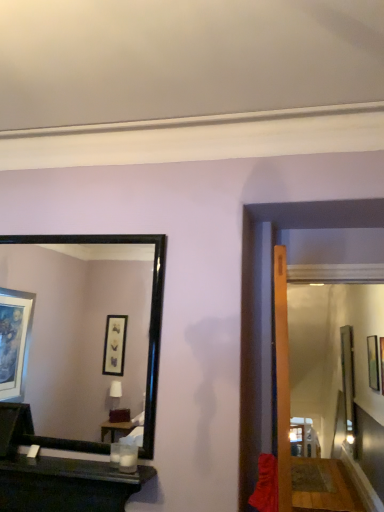
The width and height of the screenshot is (384, 512). I want to click on black glossy mirror at upper left, so click(x=79, y=336).

What do you see at coordinates (79, 336) in the screenshot? The height and width of the screenshot is (512, 384). I see `black glossy mirror at upper left` at bounding box center [79, 336].

What are the coordinates of `metallic silver picture frame at upper right` in the screenshot? It's located at (373, 362).

What is the approximate height of metallic silver picture frame at upper right?

It is 52.18 centimeters.

What do you see at coordinates (373, 362) in the screenshot? I see `metallic silver picture frame at upper right` at bounding box center [373, 362].

Identify the location of black glossy mirror at upper left. The height and width of the screenshot is (512, 384). (79, 336).

Does metallic silver picture frame at upper right appear on the left side of black glossy mirror at upper left?

No, metallic silver picture frame at upper right is not to the left of black glossy mirror at upper left.

Considering their positions, is metallic silver picture frame at upper right located in front of or behind black glossy mirror at upper left?

In the image, metallic silver picture frame at upper right appears behind black glossy mirror at upper left.

Which is behind, point (367, 344) or point (91, 374)?

Positioned behind is point (91, 374).

From the image's perspective, would you say metallic silver picture frame at upper right is shown under black glossy mirror at upper left?

Correct, metallic silver picture frame at upper right appears lower than black glossy mirror at upper left in the image.

From a real-world perspective, is metallic silver picture frame at upper right positioned over black glossy mirror at upper left based on gravity?

No, from a real-world perspective, metallic silver picture frame at upper right is not over black glossy mirror at upper left

Between metallic silver picture frame at upper right and black glossy mirror at upper left, which one has larger width?

Wider between the two is black glossy mirror at upper left.

Between metallic silver picture frame at upper right and black glossy mirror at upper left, which one has less height?

metallic silver picture frame at upper right is shorter.

Looking at the image, does metallic silver picture frame at upper right seem bigger or smaller compared to black glossy mirror at upper left?

Considering their sizes, metallic silver picture frame at upper right takes up less space than black glossy mirror at upper left.

Is black glossy mirror at upper left completely or partially inside metallic silver picture frame at upper right?

No, black glossy mirror at upper left is not inside metallic silver picture frame at upper right.

Is metallic silver picture frame at upper right far from black glossy mirror at upper left?

Yes, metallic silver picture frame at upper right and black glossy mirror at upper left are quite far apart.

Is metallic silver picture frame at upper right oriented towards black glossy mirror at upper left?

No, metallic silver picture frame at upper right does not turn towards black glossy mirror at upper left.

You are a GUI agent. You are given a task and a screenshot of the screen. Output one action in this format:
    pyautogui.click(x=<x>, y=<y>)
    Task: Click on the mirror that is above the metallic silver picture frame at upper right (from a real-world perspective)
    The image size is (384, 512).
    Given the screenshot: What is the action you would take?
    click(79, 336)

Is black glossy mirror at upper left to the left of metallic silver picture frame at upper right from the viewer's perspective?

Yes.

Which object is further away from the camera taking this photo, black glossy mirror at upper left or metallic silver picture frame at upper right?

metallic silver picture frame at upper right is behind.

Considering the positions of point (97, 308) and point (369, 351), is point (97, 308) closer or farther from the camera than point (369, 351)?

Point (97, 308) appears to be farther away from the viewer than point (369, 351).

From the image's perspective, is black glossy mirror at upper left beneath metallic silver picture frame at upper right?

No, from the image's perspective, black glossy mirror at upper left is not below metallic silver picture frame at upper right.

Based on the photo, from a real-world perspective, does black glossy mirror at upper left sit lower than metallic silver picture frame at upper right?

No.

Looking at this image, considering the sizes of black glossy mirror at upper left and metallic silver picture frame at upper right in the image, is black glossy mirror at upper left wider or thinner than metallic silver picture frame at upper right?

Considering their sizes, black glossy mirror at upper left looks broader than metallic silver picture frame at upper right.

Which of these two, black glossy mirror at upper left or metallic silver picture frame at upper right, stands taller?

Standing taller between the two is black glossy mirror at upper left.

Between black glossy mirror at upper left and metallic silver picture frame at upper right, which one has larger size?

black glossy mirror at upper left is bigger.

Is black glossy mirror at upper left inside or outside of metallic silver picture frame at upper right?

black glossy mirror at upper left is not enclosed by metallic silver picture frame at upper right.

Are black glossy mirror at upper left and metallic silver picture frame at upper right located far from each other?

Yes, black glossy mirror at upper left and metallic silver picture frame at upper right are quite far apart.

Is black glossy mirror at upper left oriented towards metallic silver picture frame at upper right?

No, black glossy mirror at upper left is not aimed at metallic silver picture frame at upper right.

Identify the location of picture frame that is below the black glossy mirror at upper left (from the image's perspective). The width and height of the screenshot is (384, 512). (373, 362).

This screenshot has width=384, height=512. In order to click on picture frame that appears below the black glossy mirror at upper left (from a real-world perspective) in this screenshot , I will do `click(373, 362)`.

Where is `picture frame that is behind the black glossy mirror at upper left`? This screenshot has width=384, height=512. picture frame that is behind the black glossy mirror at upper left is located at coordinates (373, 362).